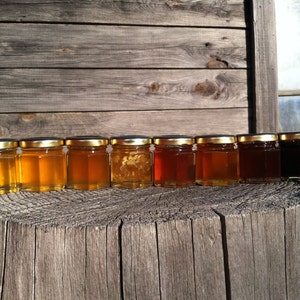
Where is `window`? window is located at coordinates (290, 109).